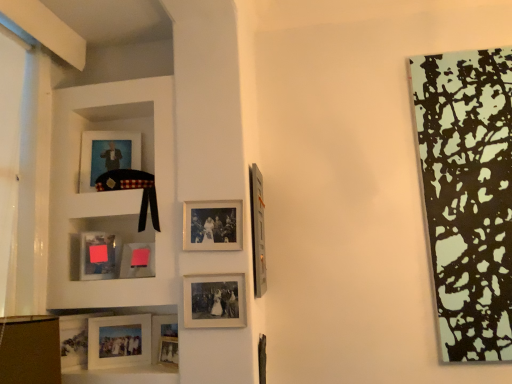
Question: Is matte silver picture frame at lower left, acting as the tenth picture frame starting from the right, positioned beyond the bounds of matte glass picture frame at lower left, which ranks as the 3th picture frame in left-to-right order?

Choices:
 (A) yes
 (B) no

Answer: (A)

Question: From a real-world perspective, is matte silver picture frame at lower left, acting as the tenth picture frame starting from the right, over matte glass picture frame at lower left, the 8th picture frame in the right-to-left sequence?

Choices:
 (A) yes
 (B) no

Answer: (B)

Question: From the image's perspective, is matte silver picture frame at lower left, acting as the tenth picture frame starting from the right, located above matte glass picture frame at lower left, which ranks as the 3th picture frame in left-to-right order?

Choices:
 (A) yes
 (B) no

Answer: (B)

Question: Is matte silver picture frame at lower left, acting as the tenth picture frame starting from the right, wider than matte glass picture frame at lower left, which ranks as the 3th picture frame in left-to-right order?

Choices:
 (A) yes
 (B) no

Answer: (B)

Question: Does matte silver picture frame at lower left, the first picture frame when ordered from left to right, have a greater height compared to matte glass picture frame at lower left, which ranks as the 3th picture frame in left-to-right order?

Choices:
 (A) no
 (B) yes

Answer: (B)

Question: In terms of size, does metallic silver picture frame at upper right, the first picture frame from the right, appear bigger or smaller than pink matte picture frame at lower center, acting as the 5th picture frame starting from the left?

Choices:
 (A) small
 (B) big

Answer: (B)

Question: From a real-world perspective, is metallic silver picture frame at upper right, the first picture frame from the right, above or below pink matte picture frame at lower center, positioned as the sixth picture frame in right-to-left order?

Choices:
 (A) below
 (B) above

Answer: (B)

Question: Is metallic silver picture frame at upper right, the first picture frame from the right, wider or thinner than pink matte picture frame at lower center, positioned as the sixth picture frame in right-to-left order?

Choices:
 (A) thin
 (B) wide

Answer: (A)

Question: Relative to pink matte picture frame at lower center, positioned as the sixth picture frame in right-to-left order, is metallic silver picture frame at upper right, the tenth picture frame in the left-to-right sequence, in front or behind?

Choices:
 (A) front
 (B) behind

Answer: (A)

Question: Considering their positions, is matte silver picture frame at center, the 9th picture frame when ordered from left to right, located in front of or behind matte silver picture frame at lower center, arranged as the 7th picture frame when viewed from the left?

Choices:
 (A) front
 (B) behind

Answer: (A)

Question: In terms of size, does matte silver picture frame at center, the 9th picture frame when ordered from left to right, appear bigger or smaller than matte silver picture frame at lower center, arranged as the 7th picture frame when viewed from the left?

Choices:
 (A) small
 (B) big

Answer: (B)

Question: Looking at their shapes, would you say matte silver picture frame at center, the 2th picture frame in the right-to-left sequence, is wider or thinner than matte silver picture frame at lower center, the fourth picture frame viewed from the right?

Choices:
 (A) wide
 (B) thin

Answer: (B)

Question: Does point (231, 319) appear closer or farther from the camera than point (176, 337)?

Choices:
 (A) closer
 (B) farther

Answer: (A)

Question: Considering the relative positions of matte glass picture frame at lower left, which ranks as the 3th picture frame in left-to-right order, and matte silver picture frame at lower center, the fourth picture frame viewed from the right, in the image provided, is matte glass picture frame at lower left, which ranks as the 3th picture frame in left-to-right order, to the left or to the right of matte silver picture frame at lower center, the fourth picture frame viewed from the right,?

Choices:
 (A) right
 (B) left

Answer: (B)

Question: Considering their positions, is matte glass picture frame at lower left, the 8th picture frame in the right-to-left sequence, located in front of or behind matte silver picture frame at lower center, the fourth picture frame viewed from the right?

Choices:
 (A) front
 (B) behind

Answer: (B)